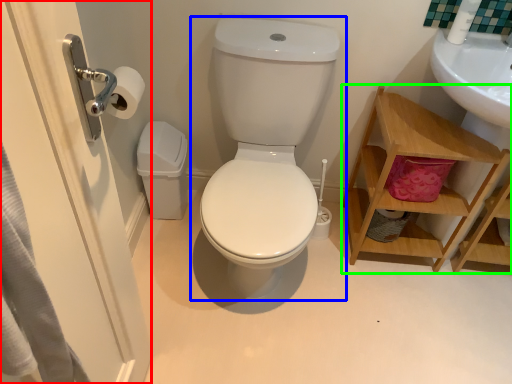
Question: Estimate the real-world distances between objects in this image. Which object is farther from screen door (highlighted by a red box), toilet (highlighted by a blue box) or shelf (highlighted by a green box)?

Choices:
 (A) toilet
 (B) shelf

Answer: (B)